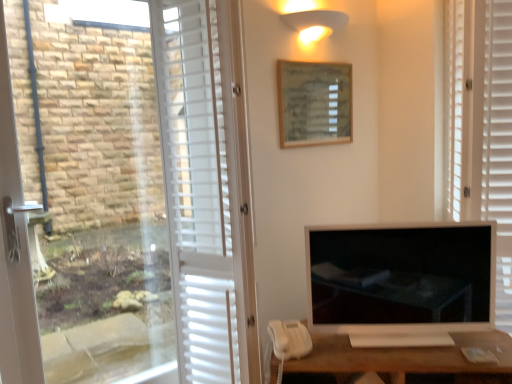
Locate an element on the screen. The height and width of the screenshot is (384, 512). vacant space underneath matte black monitor at center (from a real-world perspective) is located at coordinates (417, 336).